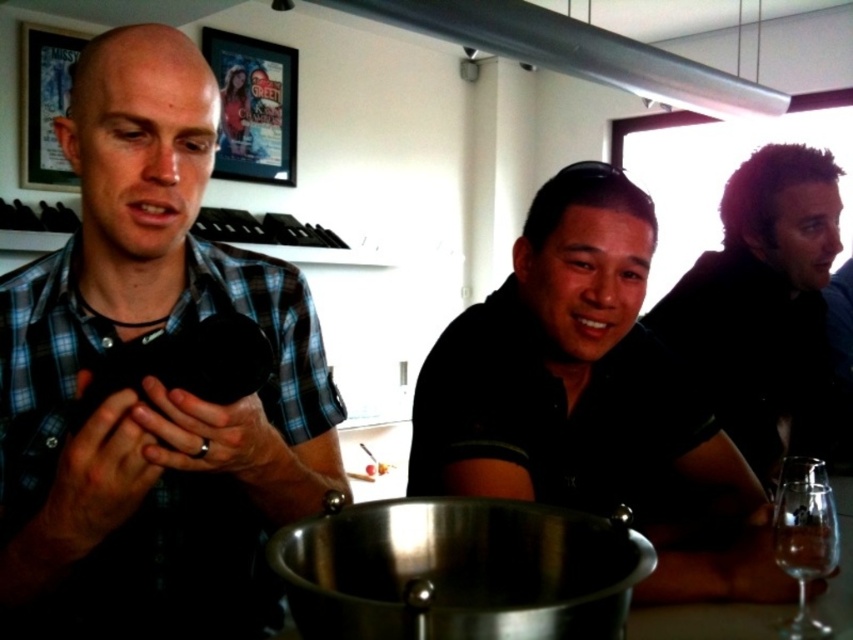
Question: Among these points, which one is farthest from the camera?

Choices:
 (A) (747, 561)
 (B) (846, 636)
 (C) (247, 413)

Answer: (A)

Question: Is the position of dark brown hair at upper right more distant than that of transparent glass wine glass at lower right?

Choices:
 (A) yes
 (B) no

Answer: (A)

Question: Is black matte shirt at center bigger than dark brown hair at upper right?

Choices:
 (A) no
 (B) yes

Answer: (B)

Question: Does dark brown hair at upper right appear on the right side of transparent glass wine glass at lower right?

Choices:
 (A) yes
 (B) no

Answer: (A)

Question: Which point is farther to the camera?

Choices:
 (A) black matte shirt at center
 (B) clear glass wine glass at lower right

Answer: (A)

Question: Which object is positioned farthest from the blue plaid shirt at left?

Choices:
 (A) dark brown hair at upper right
 (B) transparent glass wine glass at lower right

Answer: (A)